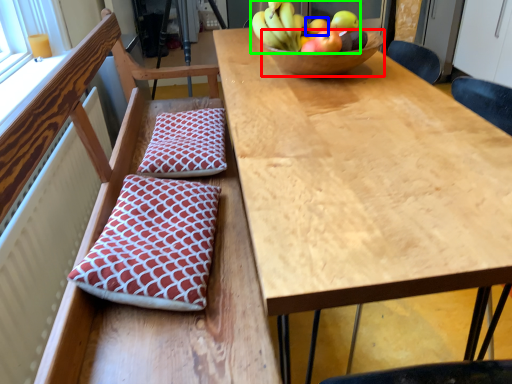
Question: Which is nearer to the bowl (highlighted by a red box)? apple (highlighted by a blue box) or banana (highlighted by a green box).

Choices:
 (A) apple
 (B) banana

Answer: (B)